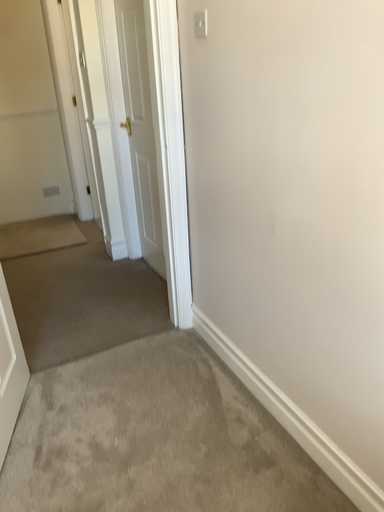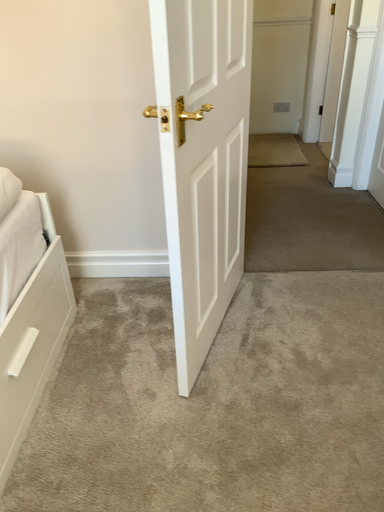
Question: Which way did the camera rotate in the video?

Choices:
 (A) rotated left
 (B) rotated right

Answer: (A)